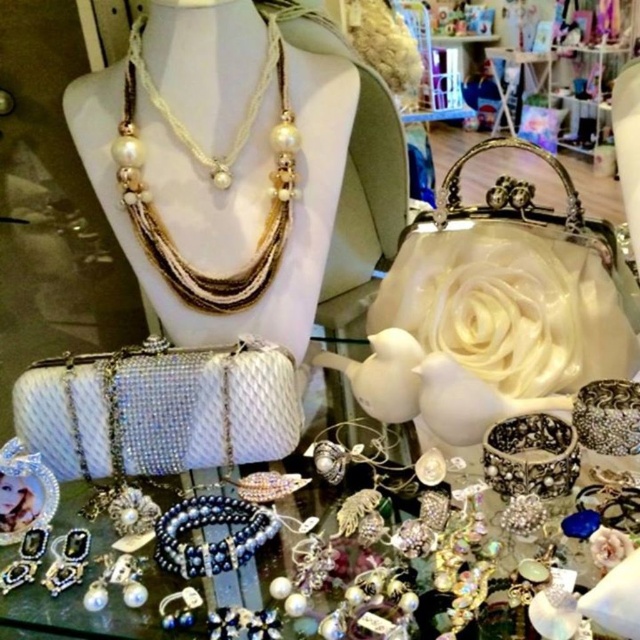
Question: Can you confirm if pearl-strand necklace at upper center is wider than pearl-strand necklace at center?

Choices:
 (A) no
 (B) yes

Answer: (B)

Question: Which object is farther from the camera taking this photo?

Choices:
 (A) pearl-strand necklace at upper center
 (B) pearl-strand necklace at center

Answer: (B)

Question: Does pearl-strand necklace at upper center come behind pearl-strand necklace at center?

Choices:
 (A) no
 (B) yes

Answer: (A)

Question: Can you confirm if satin black beaded bracelet at center is positioned to the left of pearl-strand necklace at center?

Choices:
 (A) yes
 (B) no

Answer: (B)

Question: Which point is farther to the camera?

Choices:
 (A) pearl-strand necklace at center
 (B) satin black beaded bracelet at center
 (C) pearl-strand necklace at upper center

Answer: (A)

Question: Which object appears closest to the camera in this image?

Choices:
 (A) pearl-strand necklace at upper center
 (B) satin black beaded bracelet at center

Answer: (B)